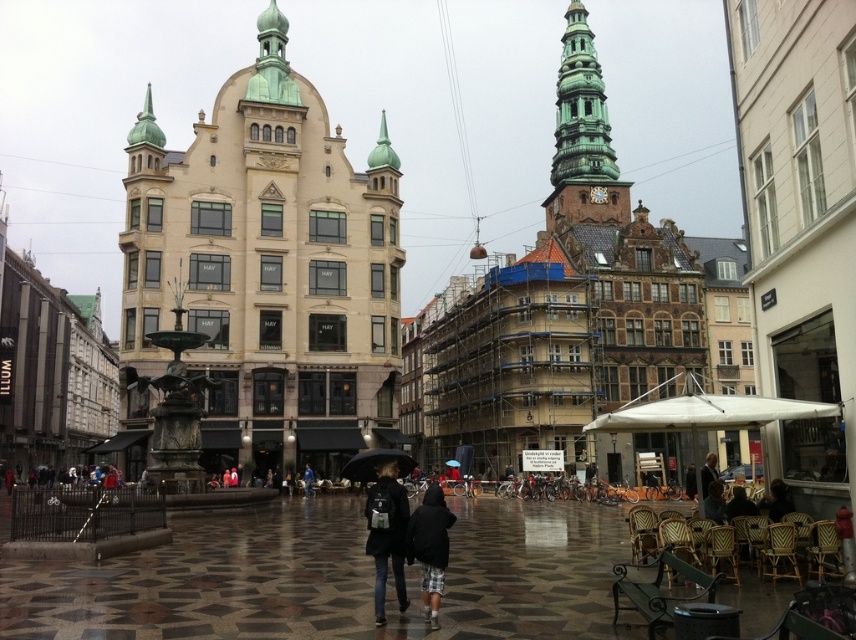
Question: Which of the following is the farthest from the observer?

Choices:
 (A) (429, 488)
 (B) (432, 492)
 (C) (577, 156)
 (D) (379, 515)

Answer: (C)

Question: Which point is closer to the camera taking this photo?

Choices:
 (A) (397, 467)
 (B) (390, 253)
 (C) (568, 65)

Answer: (A)

Question: Observing the image, what is the correct spatial positioning of dark gray hoodie at center in reference to black matte umbrella at center?

Choices:
 (A) above
 (B) below

Answer: (B)

Question: Which object appears farthest from the camera in this image?

Choices:
 (A) matte black backpack at center
 (B) beige stone building at center
 (C) dark gray backpack at center
 (D) dark gray hoodie at center

Answer: (B)

Question: From the image, what is the correct spatial relationship of beige stone building at center in relation to green copper tower at upper center?

Choices:
 (A) below
 (B) above

Answer: (A)

Question: From the image, what is the correct spatial relationship of green copper tower at upper center in relation to dark gray hoodie at center?

Choices:
 (A) left
 (B) right

Answer: (B)